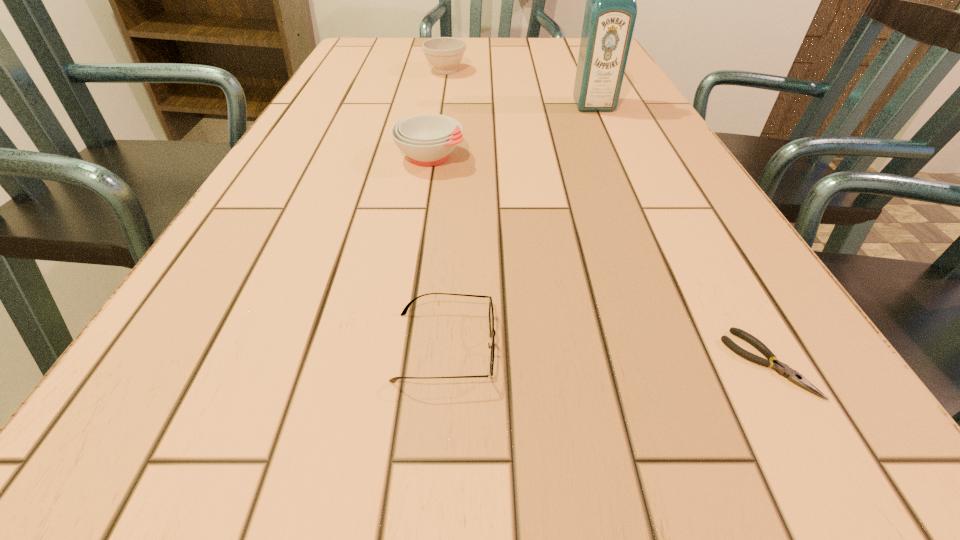
At what (x,y) coordinates should I click in order to perform the action: click on the tallest object. Please return your answer as a coordinate pair (x, y). The image size is (960, 540). Looking at the image, I should click on (610, 13).

What are the coordinates of `the second farthest object` in the screenshot? It's located at (610, 13).

Locate an element on the screen. The height and width of the screenshot is (540, 960). the farther soup bowl is located at coordinates (443, 53).

Where is `the third farthest object`? This screenshot has width=960, height=540. the third farthest object is located at coordinates (427, 139).

Locate an element on the screen. The width and height of the screenshot is (960, 540). spectacles is located at coordinates [x=491, y=313].

The image size is (960, 540). I want to click on the shortest object, so click(x=782, y=369).

Where is `free space located on the flat label side of the second farthest object`? This screenshot has width=960, height=540. free space located on the flat label side of the second farthest object is located at coordinates (604, 127).

Locate an element on the screen. The image size is (960, 540). free spot located on the right of the farther soup bowl is located at coordinates (586, 71).

Locate an element on the screen. The image size is (960, 540). free point located on the back of the nearer soup bowl is located at coordinates (442, 84).

Identify the location of vacant region located 0.070m on the front-facing side of the fourth tallest object. This screenshot has width=960, height=540. tap(554, 347).